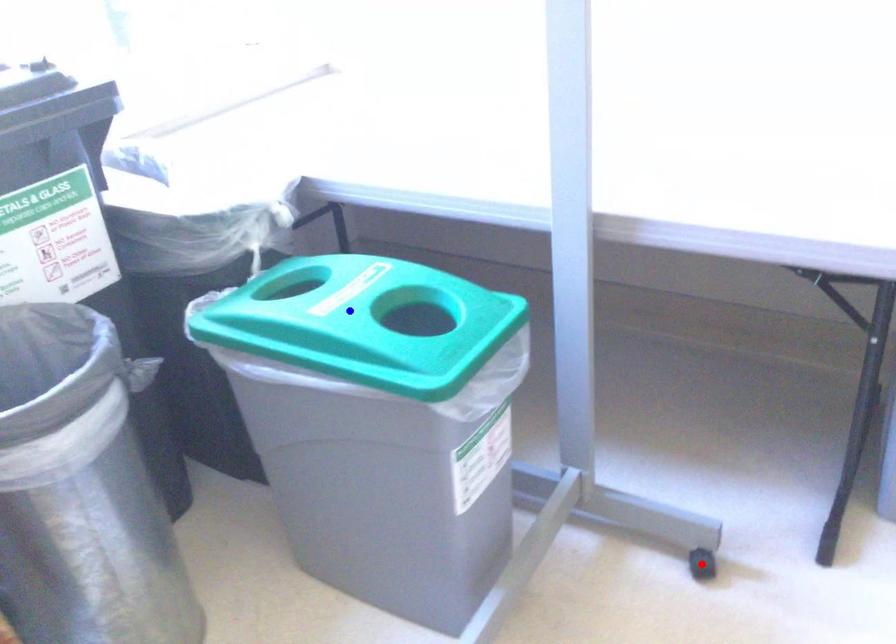
Question: Which of the two points in the image is closer to the camera?

Choices:
 (A) Blue point is closer.
 (B) Red point is closer.

Answer: (A)